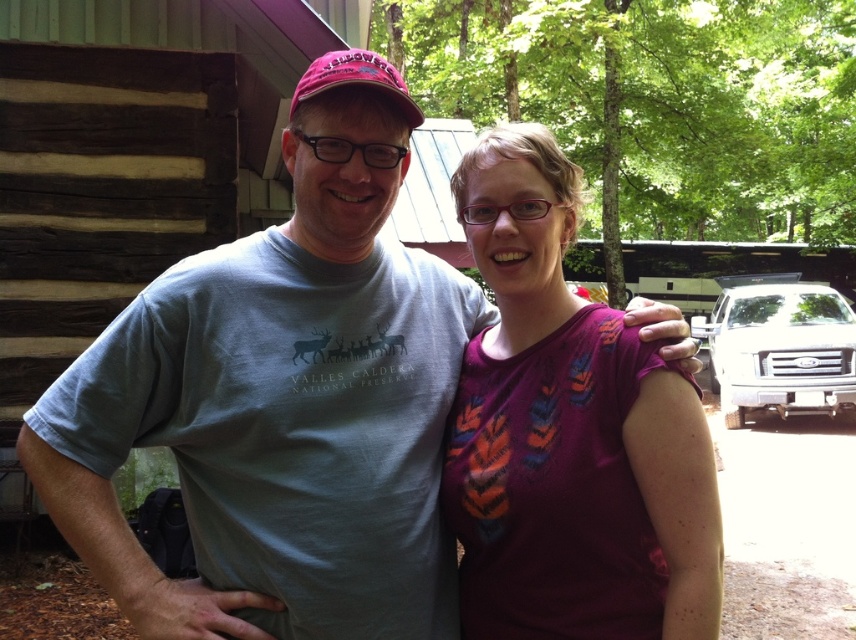
You are standing at the origin point in the image and want to reach a specific location. There are two points marked in the image. Which point, point (253, 490) or point (550, 458), is closer to you?

Point (550, 458) is closer to you because it is in front of point (253, 490).